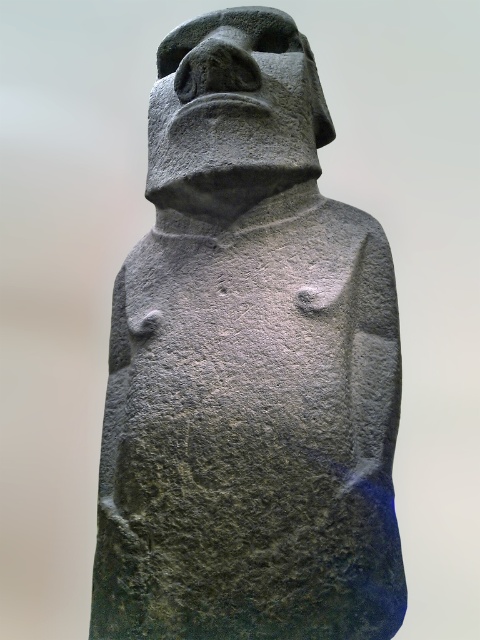
Question: Which of the following is the closest to the observer?

Choices:
 (A) (222, 97)
 (B) (180, 435)

Answer: (B)

Question: Can you confirm if gray stone statue at center is thinner than gray stone head at upper center?

Choices:
 (A) yes
 (B) no

Answer: (B)

Question: Which of the following is the closest to the observer?

Choices:
 (A) gray stone head at upper center
 (B) gray stone statue at center

Answer: (B)

Question: Observing the image, what is the correct spatial positioning of gray stone statue at center in reference to gray stone head at upper center?

Choices:
 (A) left
 (B) right

Answer: (B)

Question: Can you confirm if gray stone statue at center is positioned below gray stone head at upper center?

Choices:
 (A) no
 (B) yes

Answer: (B)